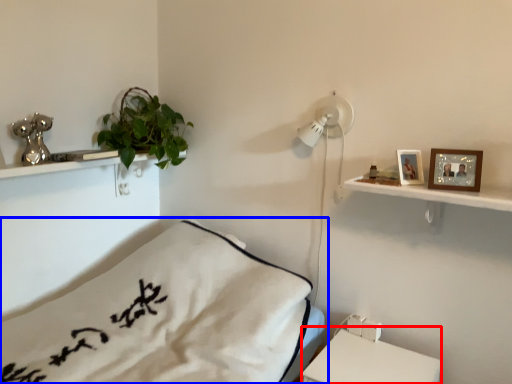
Question: Among these objects, which one is nearest to the camera, table (highlighted by a red box) or bed (highlighted by a blue box)?

Choices:
 (A) table
 (B) bed

Answer: (B)